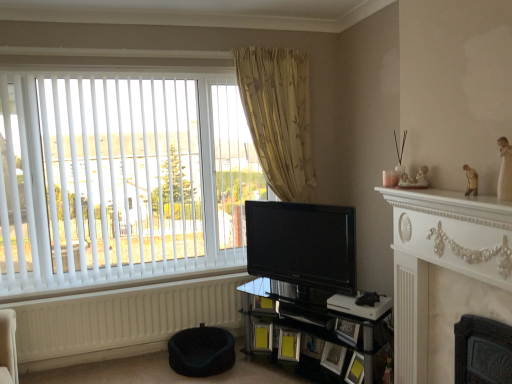
Question: Can you confirm if black glossy tv at center is smaller than matte black picture frame at lower center, marked as the fourth picture frame in a right-to-left arrangement?

Choices:
 (A) yes
 (B) no

Answer: (B)

Question: From the image's perspective, is black glossy tv at center beneath matte black picture frame at lower center, marked as the fourth picture frame in a right-to-left arrangement?

Choices:
 (A) yes
 (B) no

Answer: (B)

Question: From a real-world perspective, is black glossy tv at center beneath matte black picture frame at lower center, acting as the 3th picture frame starting from the left?

Choices:
 (A) yes
 (B) no

Answer: (B)

Question: Could you tell me if black glossy tv at center is turned towards matte black picture frame at lower center, marked as the fourth picture frame in a right-to-left arrangement?

Choices:
 (A) no
 (B) yes

Answer: (A)

Question: Can you confirm if black glossy tv at center is bigger than matte black picture frame at lower center, marked as the fourth picture frame in a right-to-left arrangement?

Choices:
 (A) no
 (B) yes

Answer: (B)

Question: Is white matte radiator at lower left spatially inside matte black picture frame at lower center, which is the fourth picture frame from left to right, or outside of it?

Choices:
 (A) inside
 (B) outside

Answer: (B)

Question: From the image's perspective, is white matte radiator at lower left located above or below matte black picture frame at lower center, which is the fourth picture frame from left to right?

Choices:
 (A) below
 (B) above

Answer: (B)

Question: Is white matte radiator at lower left in front of or behind matte black picture frame at lower center, which is the fourth picture frame from left to right, in the image?

Choices:
 (A) behind
 (B) front

Answer: (A)

Question: From a real-world perspective, relative to matte black picture frame at lower center, which is the fourth picture frame from left to right, is white matte radiator at lower left vertically above or below?

Choices:
 (A) below
 (B) above

Answer: (B)

Question: Considering their positions, is yellow matte picture frame at lower center, positioned as the first picture frame in left-to-right order, located in front of or behind black glossy tv at center?

Choices:
 (A) behind
 (B) front

Answer: (A)

Question: From a real-world perspective, relative to black glossy tv at center, is yellow matte picture frame at lower center, positioned as the first picture frame in left-to-right order, vertically above or below?

Choices:
 (A) below
 (B) above

Answer: (A)

Question: Is point (260, 331) closer or farther from the camera than point (295, 226)?

Choices:
 (A) closer
 (B) farther

Answer: (B)

Question: From the image's perspective, is yellow matte picture frame at lower center, which is counted as the sixth picture frame, starting from the right, positioned above or below black glossy tv at center?

Choices:
 (A) above
 (B) below

Answer: (B)

Question: Is black glass shelf at lower center to the left or to the right of white marble fireplace at right in the image?

Choices:
 (A) right
 (B) left

Answer: (B)

Question: Is black glass shelf at lower center wider or thinner than white marble fireplace at right?

Choices:
 (A) thin
 (B) wide

Answer: (B)